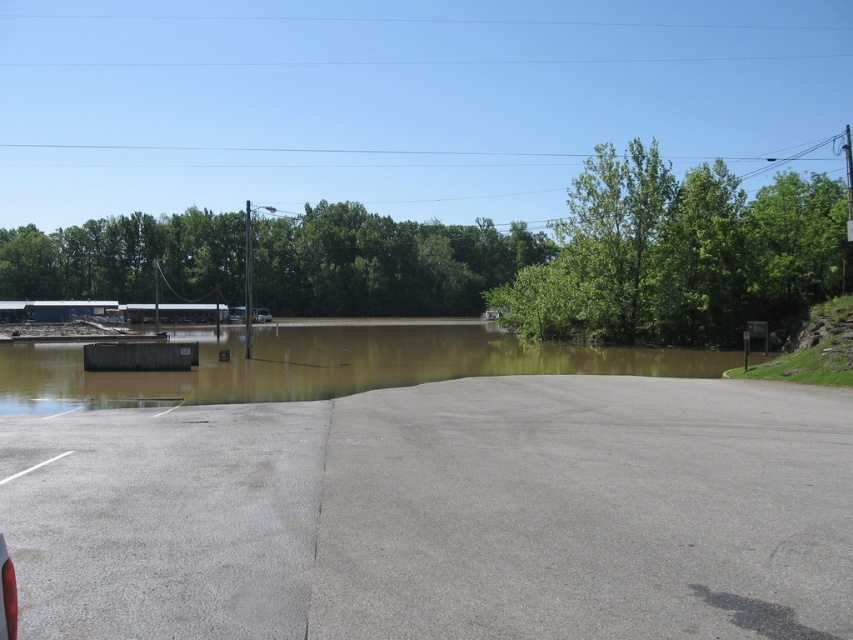
Question: Can you confirm if brown murky water at lower left is positioned to the left of silver metallic car at center?

Choices:
 (A) no
 (B) yes

Answer: (A)

Question: Which object is positioned farthest from the silver metallic car at center?

Choices:
 (A) brown murky water at lower left
 (B) gray asphalt parking lot at center

Answer: (B)

Question: Does gray asphalt parking lot at center come behind silver metallic car at center?

Choices:
 (A) no
 (B) yes

Answer: (A)

Question: Estimate the real-world distances between objects in this image. Which object is farther from the silver metallic car at center?

Choices:
 (A) brown murky water at lower left
 (B) gray asphalt parking lot at center

Answer: (B)

Question: Which of the following is the farthest from the observer?

Choices:
 (A) (268, 314)
 (B) (672, 388)
 (C) (683, 355)

Answer: (A)

Question: Is gray asphalt parking lot at center below silver metallic car at center?

Choices:
 (A) no
 (B) yes

Answer: (B)